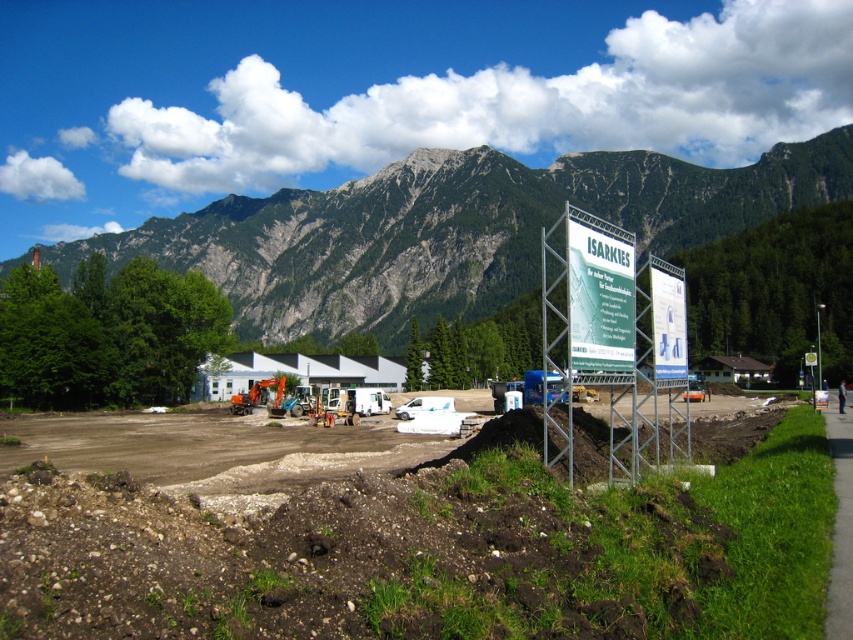
You are standing at the construction site and need to determine the relative positions of two points marked on the map. The first point is at coordinates point (173, 524) and the second is at point (843, 392). Based on the scene description, which point is closer to your current position?

Point (173, 524) is closer to the viewer than point (843, 392).